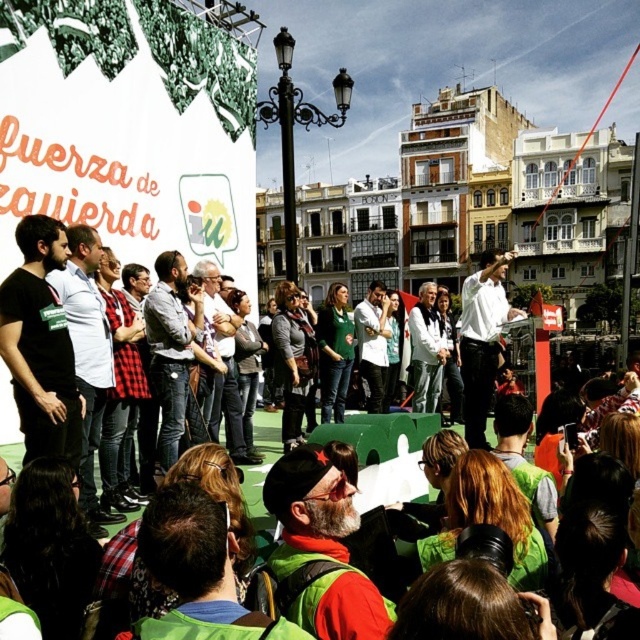
Which is in front, point (173, 433) or point (209, 262)?

Point (173, 433) is more forward.

Can you confirm if denim jeans at center is positioned to the left of light gray shirt at center?

Correct, you'll find denim jeans at center to the left of light gray shirt at center.

Between point (160, 440) and point (230, 380), which one is positioned in front?

Positioned in front is point (160, 440).

This screenshot has height=640, width=640. Find the location of `denim jeans at center`. denim jeans at center is located at coordinates (170, 349).

Between matte black shirt at left and white glossy shirt at center, which one has less height?

With less height is matte black shirt at left.

The height and width of the screenshot is (640, 640). Find the location of `matte black shirt at left`. matte black shirt at left is located at coordinates (40, 344).

Between point (301, 452) and point (170, 456), which one is positioned in front?

Point (301, 452)

How far apart are green fabric vest at center and denim jeans at center?

green fabric vest at center is 62.53 feet from denim jeans at center.

Describe the element at coordinates (323, 547) in the screenshot. This screenshot has width=640, height=640. I see `green fabric vest at center` at that location.

The image size is (640, 640). Find the location of `green fabric vest at center`. green fabric vest at center is located at coordinates (323, 547).